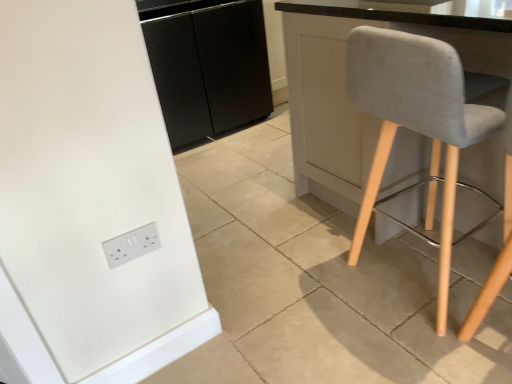
Question: Considering the relative sizes of light gray fabric chair at right and black matte cabinet at center in the image provided, is light gray fabric chair at right bigger than black matte cabinet at center?

Choices:
 (A) yes
 (B) no

Answer: (B)

Question: Can you confirm if light gray fabric chair at right is shorter than black matte cabinet at center?

Choices:
 (A) yes
 (B) no

Answer: (A)

Question: Would you say light gray fabric chair at right contains black matte cabinet at center?

Choices:
 (A) no
 (B) yes

Answer: (A)

Question: Is light gray fabric chair at right positioned in front of black matte cabinet at center?

Choices:
 (A) yes
 (B) no

Answer: (A)

Question: Could you tell me if light gray fabric chair at right is facing black matte cabinet at center?

Choices:
 (A) no
 (B) yes

Answer: (A)

Question: Is light gray fabric chair at right thinner than black matte cabinet at center?

Choices:
 (A) no
 (B) yes

Answer: (B)

Question: Can we say light gray fabric chair at right lies outside white plastic socket at lower left?

Choices:
 (A) no
 (B) yes

Answer: (B)

Question: Is light gray fabric chair at right placed right next to white plastic socket at lower left?

Choices:
 (A) yes
 (B) no

Answer: (B)

Question: Would you say light gray fabric chair at right is a long distance from white plastic socket at lower left?

Choices:
 (A) yes
 (B) no

Answer: (B)

Question: From the image's perspective, does light gray fabric chair at right appear lower than white plastic socket at lower left?

Choices:
 (A) yes
 (B) no

Answer: (B)

Question: Can you confirm if light gray fabric chair at right is positioned to the right of white plastic socket at lower left?

Choices:
 (A) yes
 (B) no

Answer: (A)

Question: Is white plastic socket at lower left completely or partially inside light gray fabric chair at right?

Choices:
 (A) no
 (B) yes

Answer: (A)

Question: Is white plastic socket at lower left outside black matte cabinet at center?

Choices:
 (A) no
 (B) yes

Answer: (B)